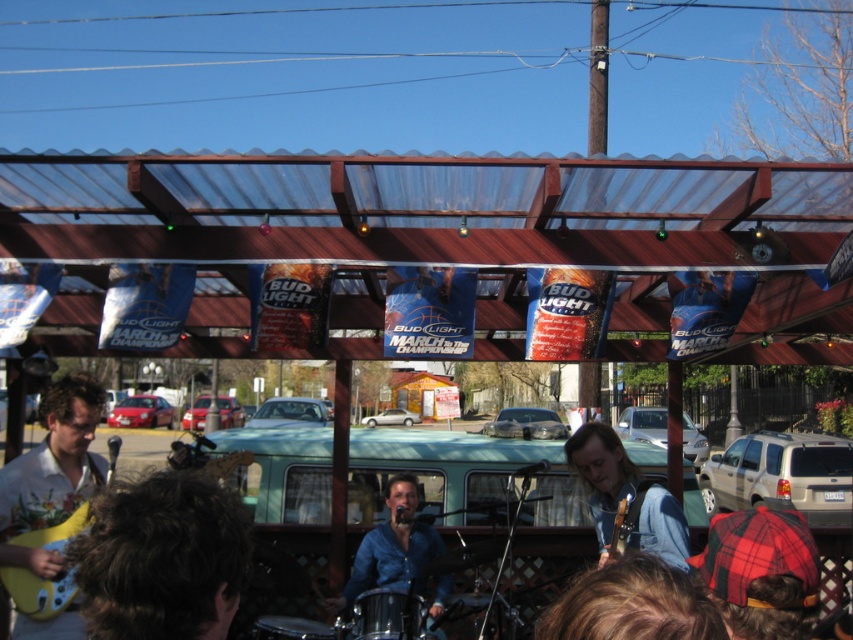
You are a photographer at the event and want to capture a photo of both the floral white shirt at lower left and the blue denim shirt at center. Which shirt should you focus on first to ensure both are in the frame?

The floral white shirt at lower left is closer to the viewer than the blue denim shirt at center, so focus on the floral white shirt at lower left first to ensure both are in the frame.

Looking at this image, you are a photographer at the event and want to capture a photo that includes both the floral white shirt at lower left and the blue denim shirt at center. Based on their heights, which shirt should be placed in the foreground to ensure both are fully visible in the frame?

The floral white shirt at lower left is taller than the blue denim shirt at center. To ensure both are fully visible, the shorter blue denim shirt at center should be placed in the foreground so that the taller floral white shirt at lower left can be positioned behind without being cropped out.